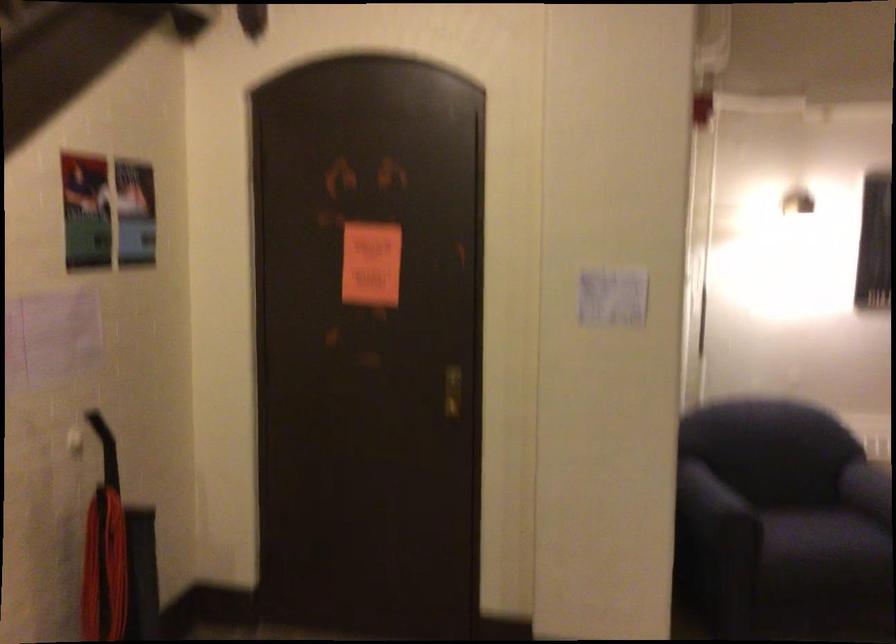
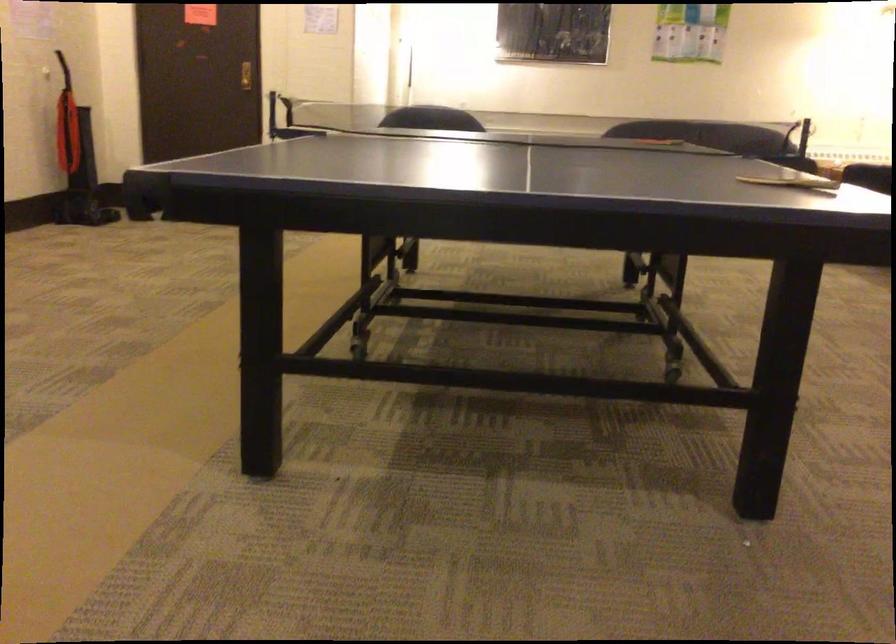
Question: Which direction would the cameraman need to move to produce the second image? Reply with the corresponding letter.

Choices:
 (A) Left
 (B) Right
 (C) Forward
 (D) Backward

Answer: (D)